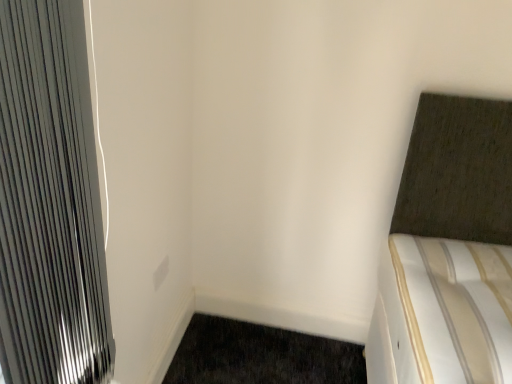
Question: Considering the positions of point (196, 327) and point (2, 112), is point (196, 327) closer or farther from the camera than point (2, 112)?

Choices:
 (A) farther
 (B) closer

Answer: (A)

Question: Is dark brown carpet at lower left inside the boundaries of metallic silver radiator at left, or outside?

Choices:
 (A) inside
 (B) outside

Answer: (B)

Question: Estimate the real-world distances between objects in this image. Which object is closer to the dark brown carpet at lower left?

Choices:
 (A) white matte electric outlet at center
 (B) metallic silver radiator at left

Answer: (A)

Question: Which object is the farthest from the white matte electric outlet at center?

Choices:
 (A) dark brown carpet at lower left
 (B) metallic silver radiator at left

Answer: (B)